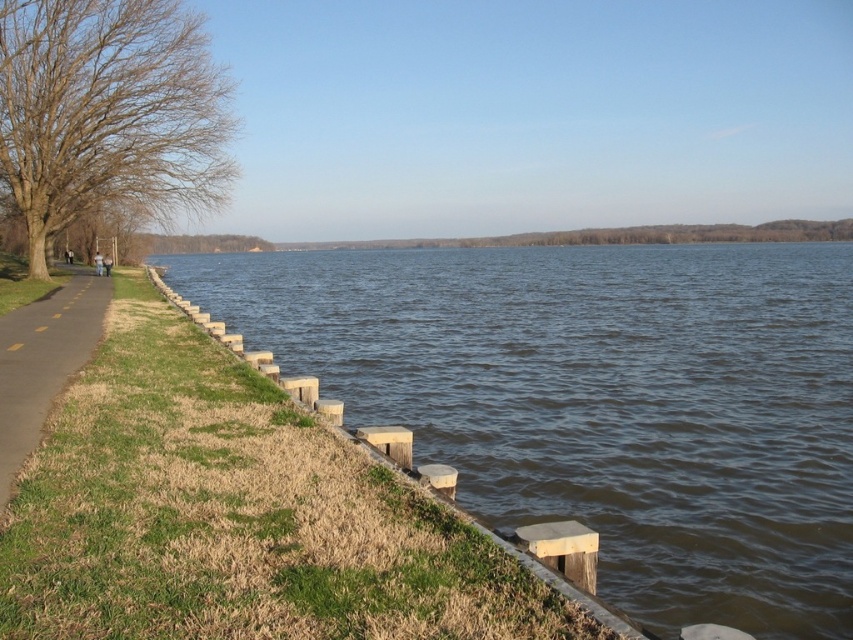
Which of these two, green grass at lower left or yellow painted asphalt at left, stands shorter?

With less height is green grass at lower left.

Does green grass at lower left have a greater height compared to yellow painted asphalt at left?

In fact, green grass at lower left may be shorter than yellow painted asphalt at left.

Between point (311, 477) and point (61, 348), which one is positioned in front?

Positioned in front is point (311, 477).

Identify the location of green grass at lower left. (235, 515).

Is green grass at lower left bigger than brown leafless tree at left?

Actually, green grass at lower left might be smaller than brown leafless tree at left.

Based on the photo, which is more to the right, green grass at lower left or brown leafless tree at left?

green grass at lower left is more to the right.

Is point (305, 636) more distant than point (199, 211)?

No, it is not.

Find the location of `green grass at lower left`. green grass at lower left is located at coordinates (235, 515).

Is brown leafless tree at left below yellow painted asphalt at left?

Actually, brown leafless tree at left is above yellow painted asphalt at left.

Which of these two, brown leafless tree at left or yellow painted asphalt at left, stands shorter?

yellow painted asphalt at left is shorter.

Locate an element on the screen. The image size is (853, 640). brown leafless tree at left is located at coordinates (108, 113).

Locate an element on the screen. This screenshot has height=640, width=853. brown leafless tree at left is located at coordinates (108, 113).